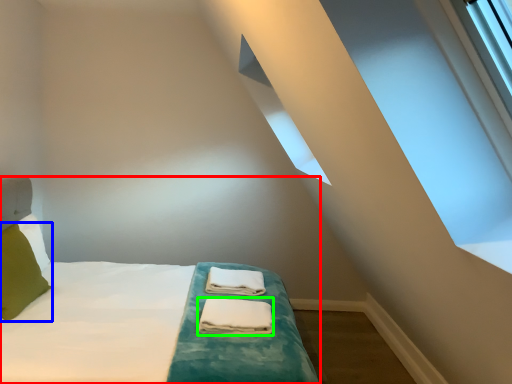
Question: Considering the real-world distances, which object is closest to bed (highlighted by a red box)? pillow (highlighted by a blue box) or material (highlighted by a green box).

Choices:
 (A) pillow
 (B) material

Answer: (B)